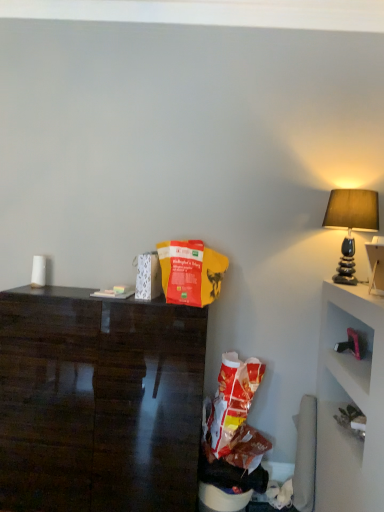
Question: From a real-world perspective, is matte stone lamp at right on dark wood desk at left?

Choices:
 (A) no
 (B) yes

Answer: (B)

Question: Is dark wood desk at left a part of matte stone lamp at right?

Choices:
 (A) yes
 (B) no

Answer: (B)

Question: Can you confirm if matte stone lamp at right is smaller than dark wood desk at left?

Choices:
 (A) yes
 (B) no

Answer: (A)

Question: Is matte stone lamp at right placed right next to dark wood desk at left?

Choices:
 (A) no
 (B) yes

Answer: (A)

Question: Is matte stone lamp at right at the left side of dark wood desk at left?

Choices:
 (A) no
 (B) yes

Answer: (A)

Question: Based on their sizes in the image, would you say matte stone lamp at right is bigger or smaller than red matte paper bag at center?

Choices:
 (A) small
 (B) big

Answer: (B)

Question: Considering their positions, is matte stone lamp at right located in front of or behind red matte paper bag at center?

Choices:
 (A) front
 (B) behind

Answer: (B)

Question: From the image's perspective, is matte stone lamp at right above or below red matte paper bag at center?

Choices:
 (A) below
 (B) above

Answer: (B)

Question: Is point (359, 226) closer or farther from the camera than point (203, 283)?

Choices:
 (A) closer
 (B) farther

Answer: (B)

Question: In the image, is red matte paper bag at center on the left side or the right side of matte stone lamp at right?

Choices:
 (A) right
 (B) left

Answer: (B)

Question: Is red matte paper bag at center inside or outside of matte stone lamp at right?

Choices:
 (A) inside
 (B) outside

Answer: (B)

Question: In terms of size, does red matte paper bag at center appear bigger or smaller than matte stone lamp at right?

Choices:
 (A) big
 (B) small

Answer: (B)

Question: In the image, is red matte paper bag at center positioned in front of or behind matte stone lamp at right?

Choices:
 (A) behind
 (B) front

Answer: (B)

Question: Considering their positions, is matte stone lamp at right located in front of or behind dark wood desk at left?

Choices:
 (A) front
 (B) behind

Answer: (B)

Question: From their relative heights in the image, would you say matte stone lamp at right is taller or shorter than dark wood desk at left?

Choices:
 (A) short
 (B) tall

Answer: (A)